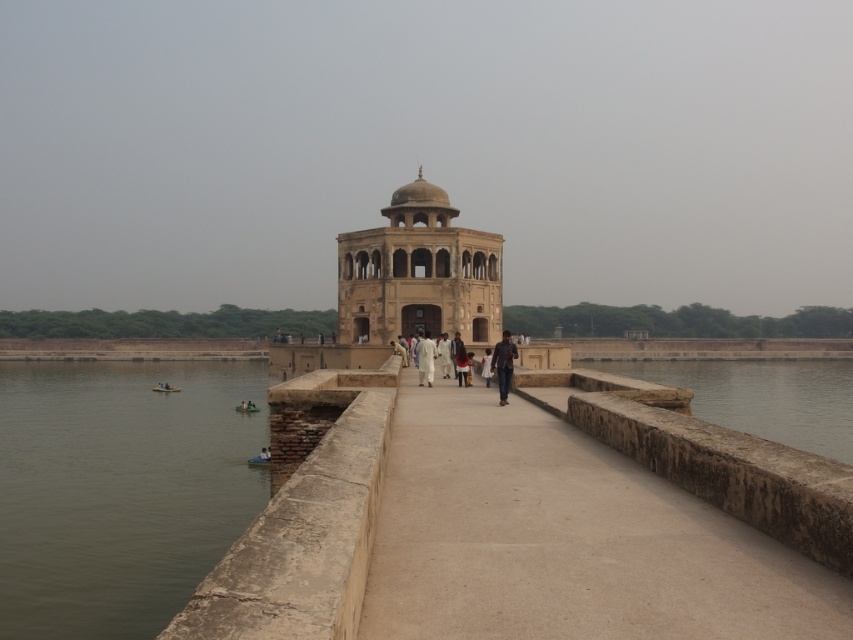
You are standing at the entrance of the pathway leading to the historic structure. If you walk straight ahead along the smooth stone pathway at center, where will you end up?

If you walk straight ahead along the smooth stone pathway at center, you will end up at the historic structure located at the end of the pathway.

You are standing at the entrance of the pathway leading to the historic structure. You see the smooth stone pathway at center and the white cotton person at center. Which object is taller?

The white cotton person at center is taller than the smooth stone pathway at center.

You are a tour guide leading a group to the beige stone palace at center. The pathway you are walking on is the smooth stone pathway at center. If your group wants to walk side by side, can they fit on the pathway without crossing the low walls on either side?

The smooth stone pathway at center is narrower than the beige stone palace at center. Since the pathway is narrower, it may not allow the group to walk side by side comfortably without crossing the low walls on either side. The exact width isnecessary to determine feasibility, but based on the comparison, it is likely too narrow.